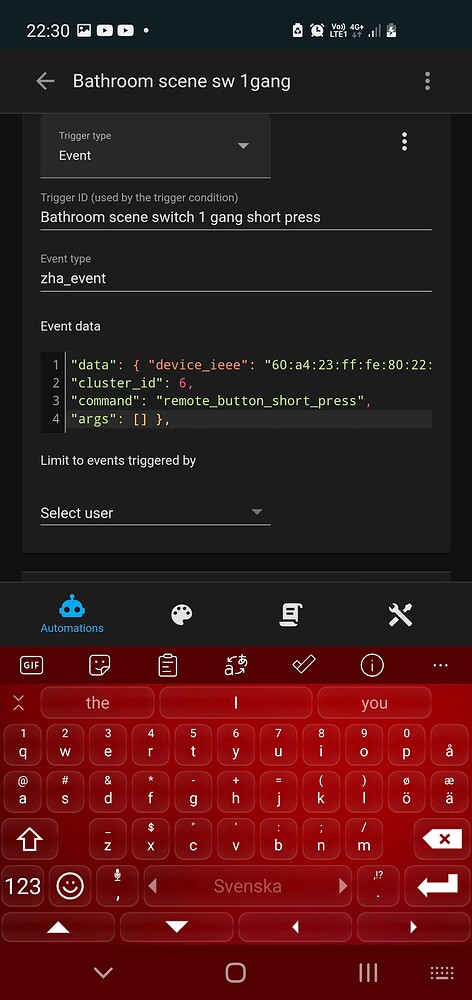
Image resolution: width=472 pixels, height=1000 pixels. What are the coordinates of `keyboard` in the screenshot? It's located at (36, 715).